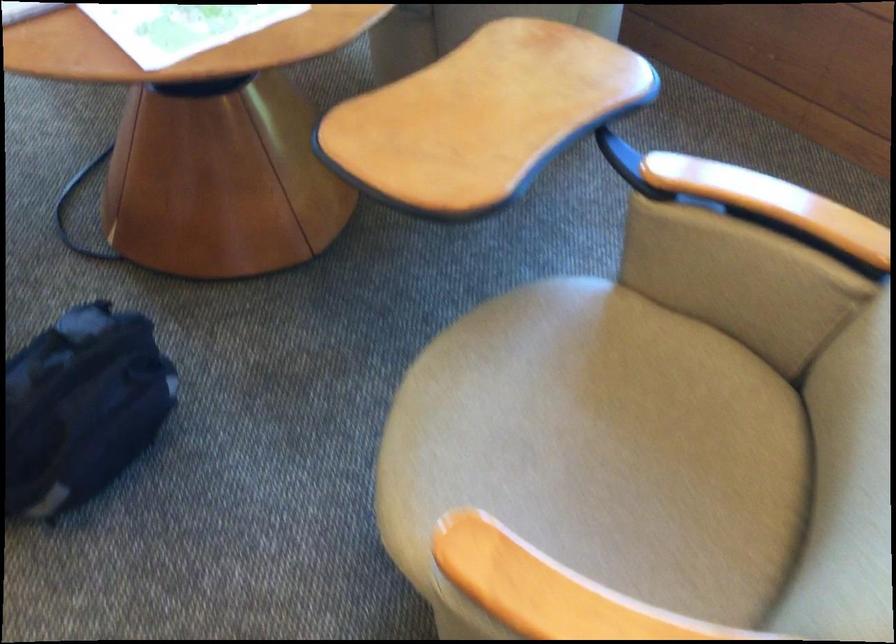
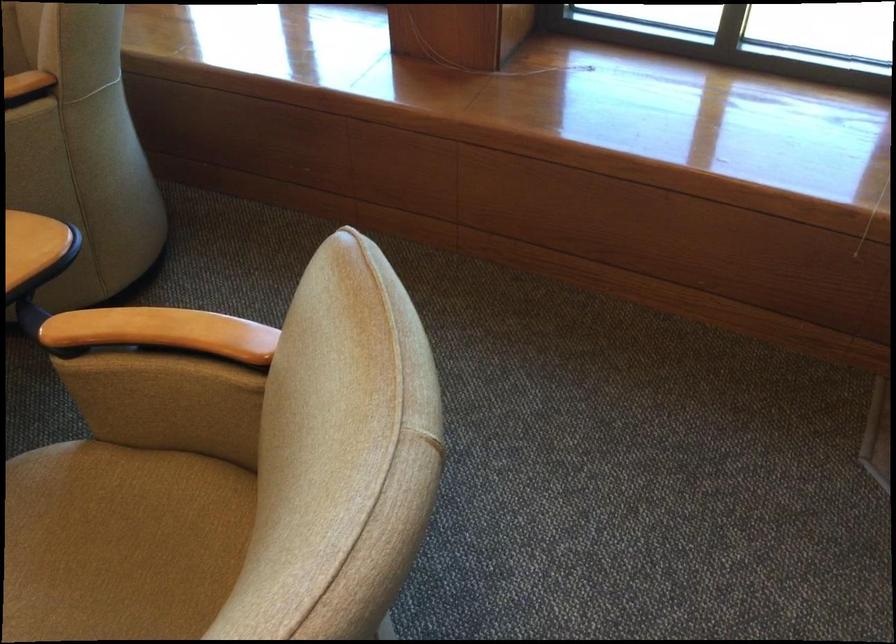
Find the pixel in the second image that matches (x=655, y=389) in the first image.

(121, 542)